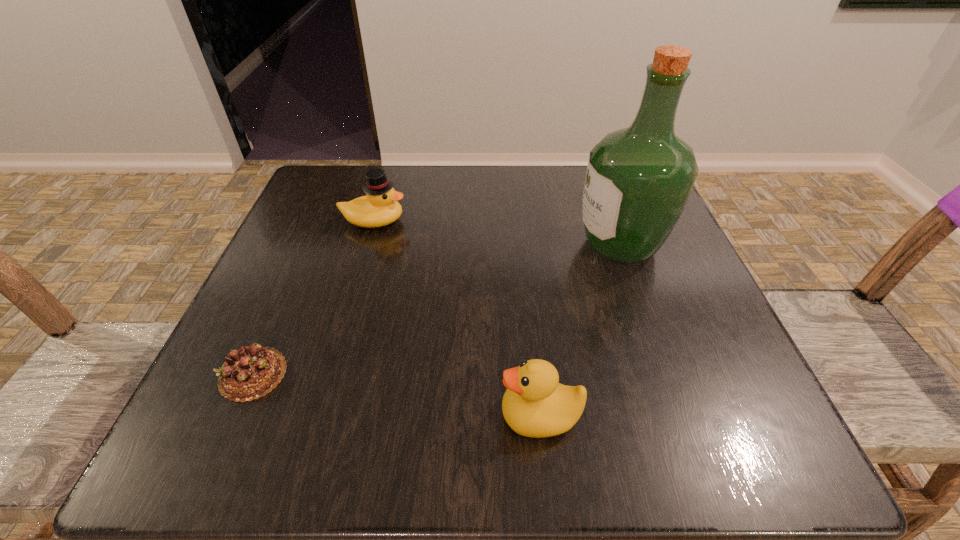
Locate an element on the screen. vacant space located at the beak of the third object from left to right is located at coordinates (420, 416).

You are a GUI agent. You are given a task and a screenshot of the screen. Output one action in this format:
    pyautogui.click(x=<x>, y=<y>)
    Task: Click on the free location located at the beak of the third object from left to right
    Image resolution: width=960 pixels, height=540 pixels.
    Given the screenshot: What is the action you would take?
    pyautogui.click(x=208, y=416)

Find the location of a particular element. This screenshot has width=960, height=540. free space located on the front-facing side of the farther duck is located at coordinates (450, 221).

Find the location of a particular element. vacant space located on the right of the chocolate cake is located at coordinates (495, 374).

The height and width of the screenshot is (540, 960). I want to click on liquor positioned at the far edge, so click(638, 180).

Locate an element on the screen. The height and width of the screenshot is (540, 960). duck present at the far edge is located at coordinates (380, 207).

Image resolution: width=960 pixels, height=540 pixels. In order to click on duck at the near edge in this screenshot , I will do `click(535, 404)`.

Image resolution: width=960 pixels, height=540 pixels. What are the coordinates of `chocolate cake situated at the near edge` in the screenshot? It's located at (251, 372).

You are a GUI agent. You are given a task and a screenshot of the screen. Output one action in this format:
    pyautogui.click(x=<x>, y=<y>)
    Task: Click on the duck at the left edge
    
    Given the screenshot: What is the action you would take?
    pyautogui.click(x=380, y=207)

Image resolution: width=960 pixels, height=540 pixels. In order to click on chocolate cake positioned at the left edge in this screenshot , I will do pos(251,372).